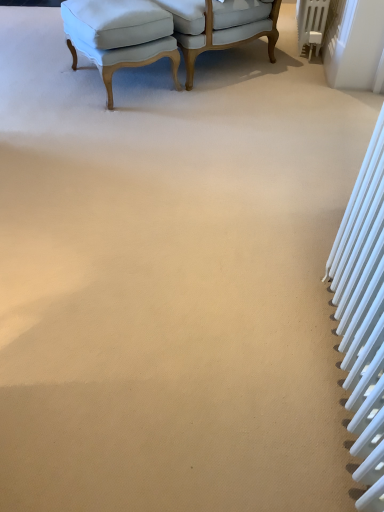
Question: From the image's perspective, is light blue fabric ottoman at upper left, the 1th chair positioned from the left, above or below white metallic radiator at right, the first radiator from the bottom?

Choices:
 (A) below
 (B) above

Answer: (B)

Question: Is light blue fabric ottoman at upper left, the 1th chair positioned from the left, in front of or behind white metallic radiator at right, positioned as the first radiator in left-to-right order, in the image?

Choices:
 (A) front
 (B) behind

Answer: (B)

Question: Which of these objects is positioned closest to the light blue fabric ottoman at upper left, the 1th chair positioned from the left?

Choices:
 (A) light blue fabric chair at upper center, the second chair from the left
 (B) white metallic radiator at upper right, the first radiator from the back
 (C) white metallic radiator at right, positioned as the first radiator in left-to-right order

Answer: (A)

Question: Which of these objects is positioned closest to the light blue fabric ottoman at upper left, acting as the second chair starting from the right?

Choices:
 (A) white metallic radiator at upper right, arranged as the second radiator when viewed from the front
 (B) light blue fabric chair at upper center, the second chair from the left
 (C) white metallic radiator at right, the 2th radiator viewed from the top

Answer: (B)